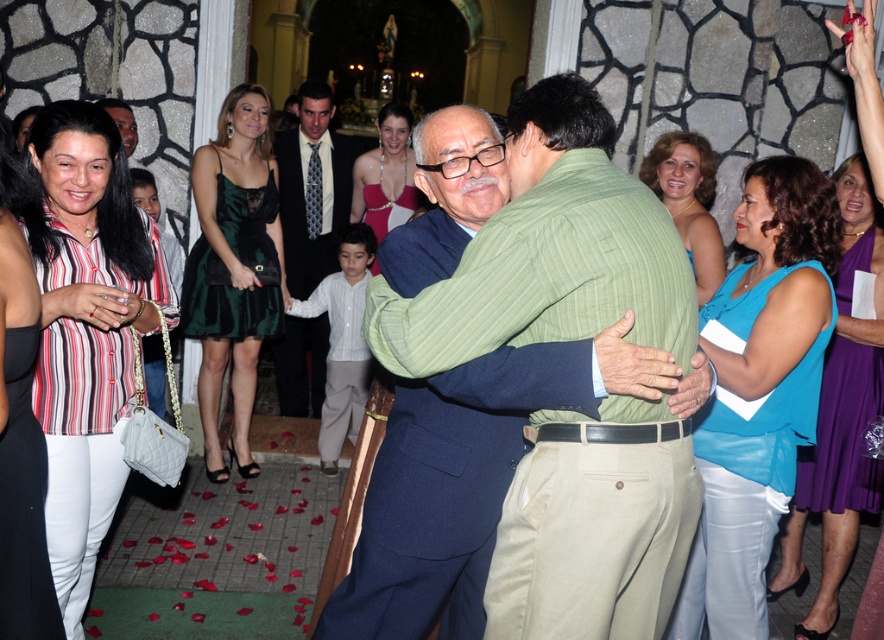
You are a photographer at the event and need to capture both the striped cotton blouse at left and the green satin dress at center in a single frame. Which clothing item should you focus on first to ensure both are in the frame?

The striped cotton blouse at left is smaller in size compared to the green satin dress at center, so you should focus on framing the green satin dress at center first to accommodate its larger size within the shot.

Looking at this image, you are standing at the entrance of the church and want to take a photo of the point at coordinates point (70, 259). The camera you have can focus on objects within 10 feet. Will the point be in focus?

The distance of point (70, 259) from camera is 8.18 feet, which is within the camera focus range of 10 feet. Therefore, the point will be in focus.

You are a photographer at the event and want to take a photo that includes both the light blue shirt at center and the shiny pink dress at center. Which one should you focus on first to ensure both are in the frame?

You should focus on the light blue shirt at center first since it is closer to you than the shiny pink dress at center, ensuring both are in the frame.